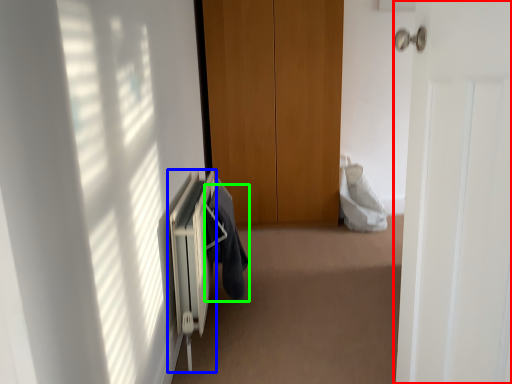
Question: Which is farther away from door (highlighted by a red box)? radiator (highlighted by a blue box) or garment (highlighted by a green box)?

Choices:
 (A) radiator
 (B) garment

Answer: (B)